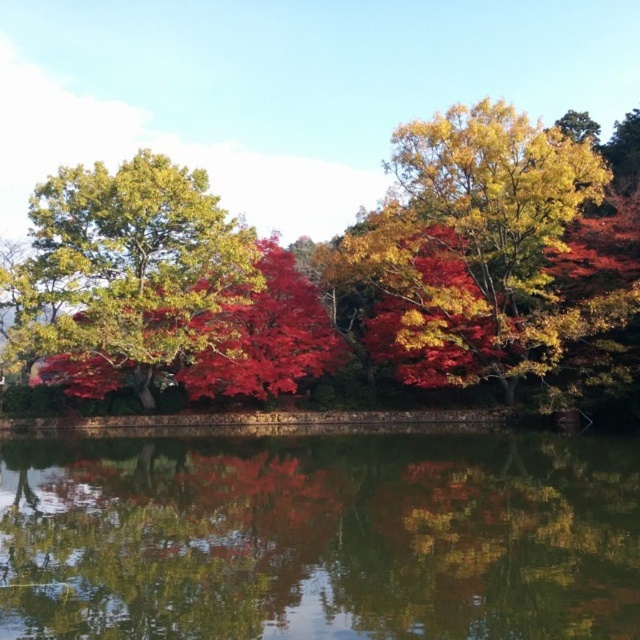
Locate an element on the screen. The width and height of the screenshot is (640, 640). green reflective water at center is located at coordinates (321, 538).

Between green reflective water at center and shiny red leaves at center, which one appears on the right side from the viewer's perspective?

Positioned to the right is shiny red leaves at center.

Is point (51, 614) in front of point (268, 268)?

That is True.

Identify the location of green reflective water at center. The image size is (640, 640). (321, 538).

Can you confirm if shiny red leaves at center is wider than shiny green leaves at left?

Yes, shiny red leaves at center is wider than shiny green leaves at left.

In the scene shown: Does shiny red leaves at center have a smaller size compared to shiny green leaves at left?

No, shiny red leaves at center is not smaller than shiny green leaves at left.

The height and width of the screenshot is (640, 640). What do you see at coordinates (396, 284) in the screenshot?
I see `shiny red leaves at center` at bounding box center [396, 284].

The width and height of the screenshot is (640, 640). I want to click on shiny red leaves at center, so click(x=396, y=284).

Based on the photo, is green reflective water at center below shiny green leaves at left?

Yes, green reflective water at center is below shiny green leaves at left.

Is green reflective water at center thinner than shiny green leaves at left?

In fact, green reflective water at center might be wider than shiny green leaves at left.

Is point (323, 612) in front of point (131, 220)?

Yes, point (323, 612) is in front of point (131, 220).

Image resolution: width=640 pixels, height=640 pixels. I want to click on green reflective water at center, so click(321, 538).